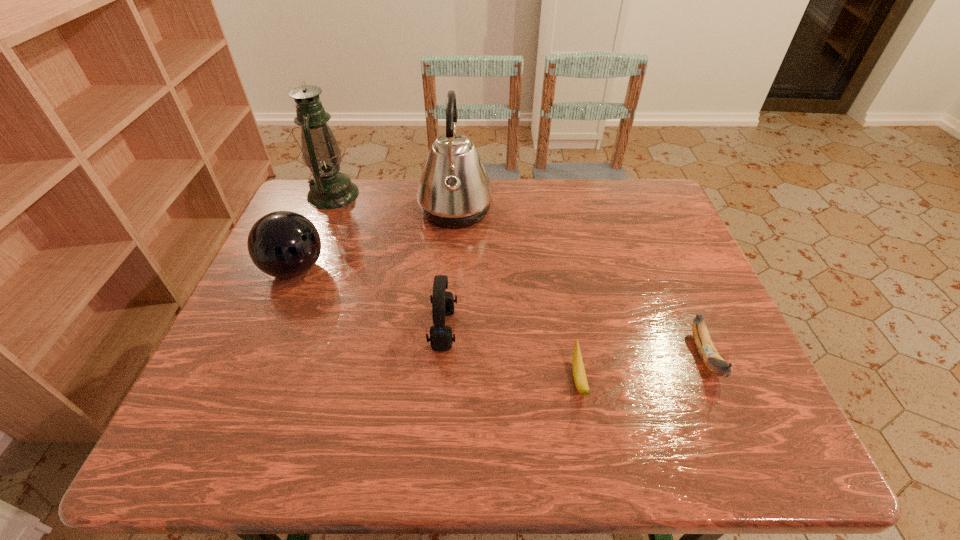
Where is `kettle`? The height and width of the screenshot is (540, 960). kettle is located at coordinates (454, 191).

Where is `oil lamp`? oil lamp is located at coordinates (329, 189).

In order to click on bowling ball in this screenshot , I will do `click(283, 244)`.

The width and height of the screenshot is (960, 540). I want to click on the fourth tallest object, so click(441, 339).

The width and height of the screenshot is (960, 540). Identify the location of the fifth tallest object. (715, 363).

You are a GUI agent. You are given a task and a screenshot of the screen. Output one action in this format:
    pyautogui.click(x=<x>, y=<y>)
    Task: Click on the right banana
    This screenshot has height=540, width=960.
    Given the screenshot: What is the action you would take?
    pyautogui.click(x=715, y=363)

Where is `the second object from right to left`? The image size is (960, 540). the second object from right to left is located at coordinates (579, 374).

I want to click on the left banana, so [x=579, y=374].

Locate an element on the screen. Image resolution: width=960 pixels, height=540 pixels. blank space located 0.280m from the spout of the kettle is located at coordinates (587, 212).

This screenshot has height=540, width=960. Identify the location of vacant area located on the front of the oil lamp. (301, 272).